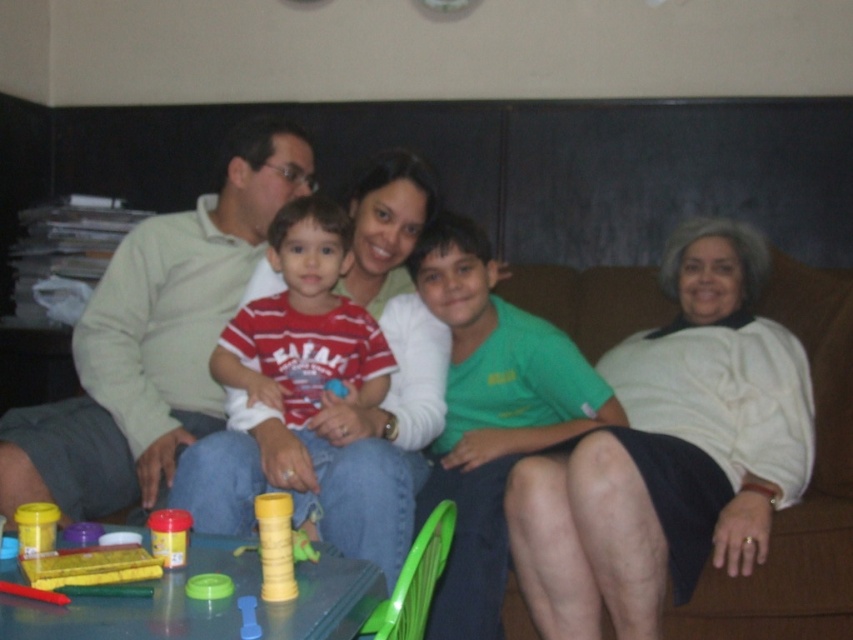
Between white sweater at center and matte yellow cup at lower left, which one has less height?

matte yellow cup at lower left

Which is behind, point (689, 458) or point (45, 522)?

The point (689, 458) is behind.

Is point (647, 588) less distant than point (22, 547)?

No, (647, 588) is behind (22, 547).

This screenshot has width=853, height=640. Identify the location of white sweater at center. [670, 451].

Looking at this image, is matte green shirt at center positioned at the back of matte yellow cup at lower left?

Yes, it is behind matte yellow cup at lower left.

Measure the distance between matte green shirt at center and matte yellow cup at lower left.

matte green shirt at center is 33.85 inches away from matte yellow cup at lower left.

Locate an element on the screen. The height and width of the screenshot is (640, 853). matte green shirt at center is located at coordinates (154, 340).

Locate an element on the screen. matte green shirt at center is located at coordinates (154, 340).

Does white sweater at center have a greater width compared to yellow matte tower at center?

Yes, white sweater at center is wider than yellow matte tower at center.

Is point (715, 544) farther from camera compared to point (271, 513)?

Yes.

Does point (631, 570) come closer to viewer compared to point (277, 506)?

No, (631, 570) is further to viewer.

The width and height of the screenshot is (853, 640). Identify the location of white sweater at center. (670, 451).